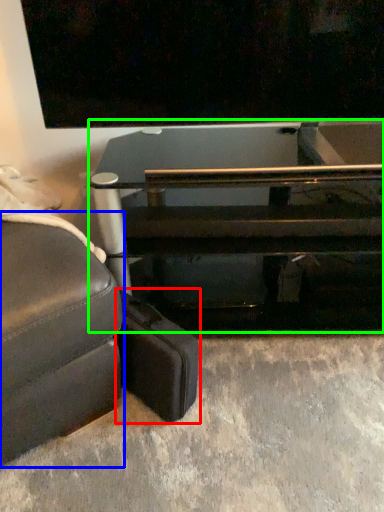
Question: Which object is positioned closest to luggage (highlighted by a red box)? Select from studio couch (highlighted by a blue box) and table (highlighted by a green box).

Choices:
 (A) studio couch
 (B) table

Answer: (A)